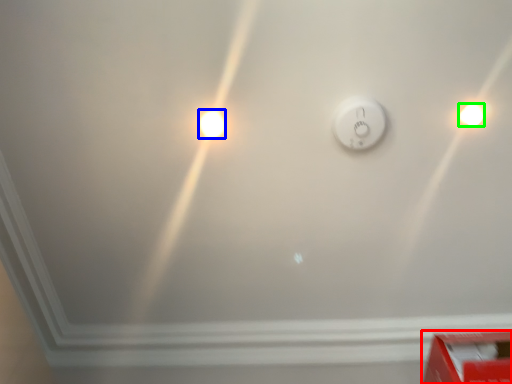
Question: Considering the real-world distances, which object is farthest from box (highlighted by a red box)? light bulb (highlighted by a blue box) or light bulb (highlighted by a green box)?

Choices:
 (A) light bulb
 (B) light bulb

Answer: (A)